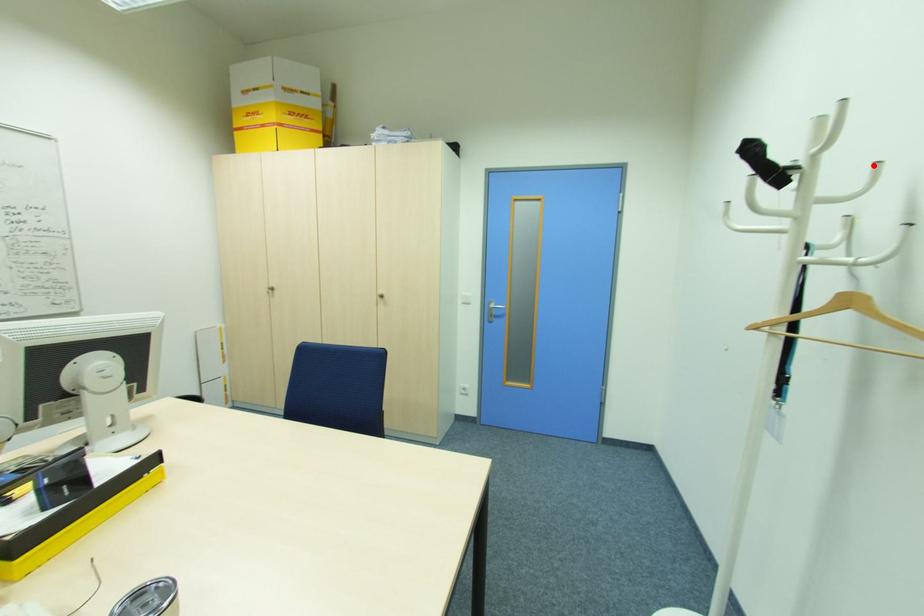
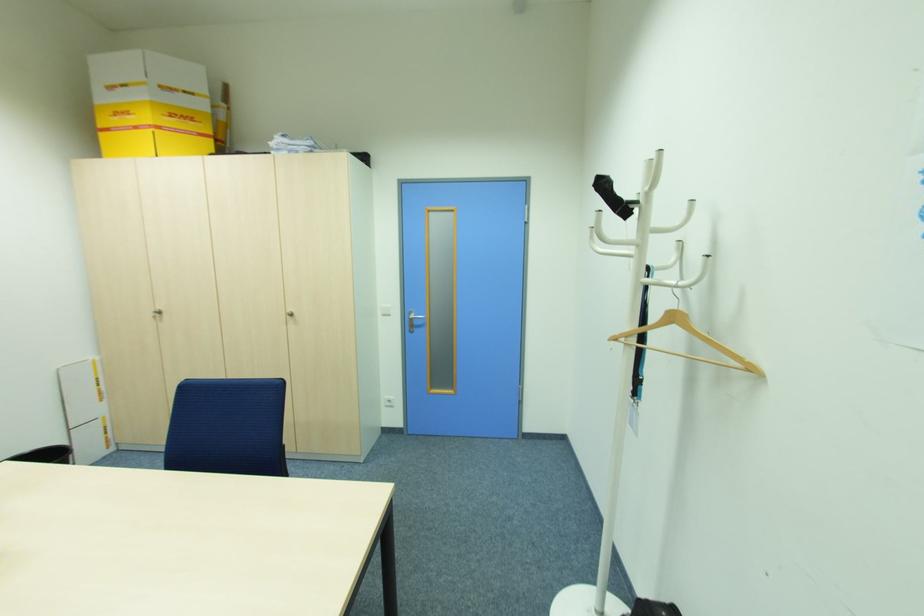
In the second image, find the point that corresponds to the highlighted location in the first image.

(688, 204)